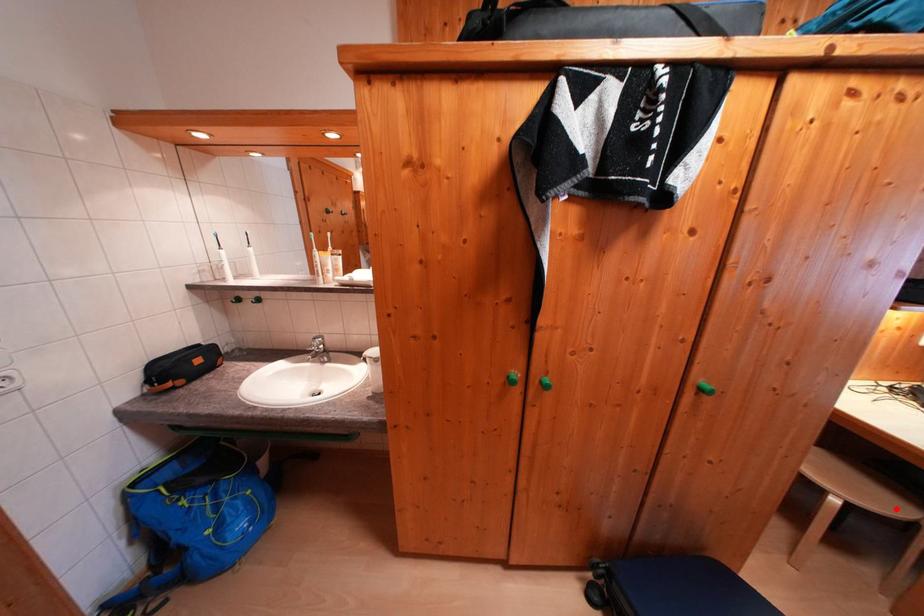
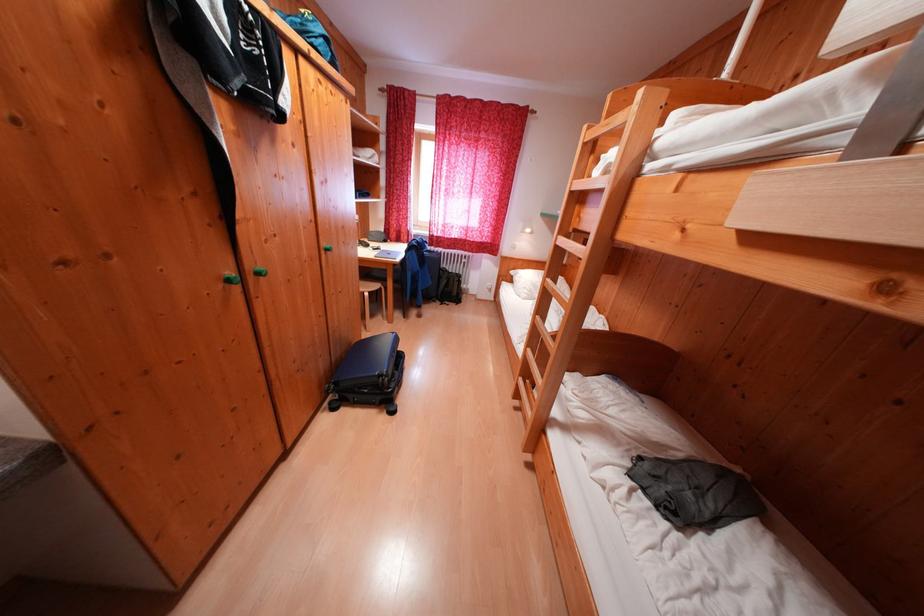
Where in the second image is the point corresponding to the highlighted location from the first image?

(383, 290)